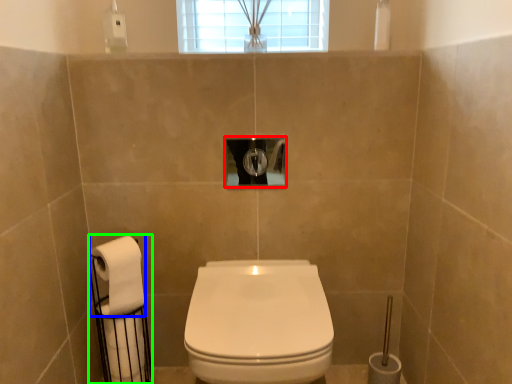
Question: Based on their relative distances, which object is nearer to hole (highlighted by a red box)? Choose from toilet paper (highlighted by a blue box) and toilet paper (highlighted by a green box).

Choices:
 (A) toilet paper
 (B) toilet paper

Answer: (A)